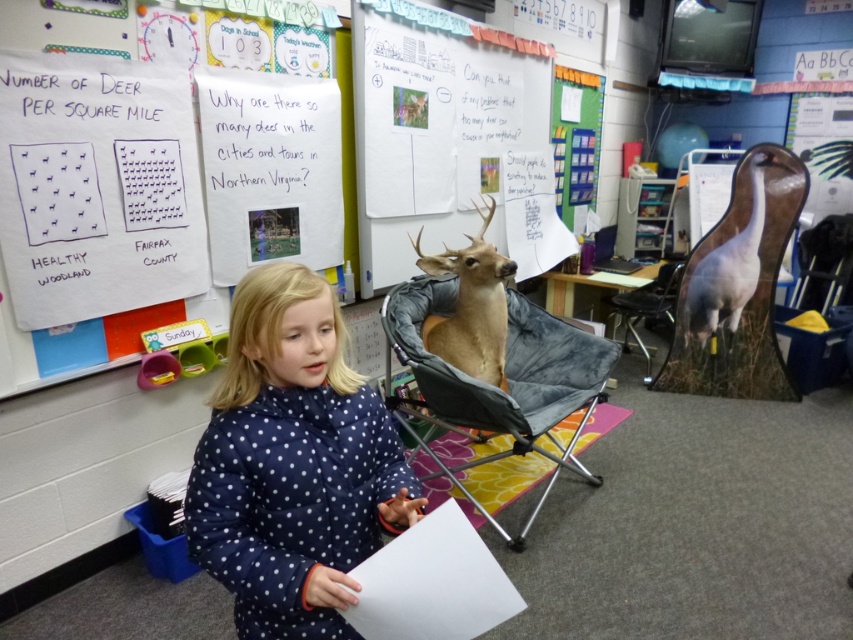
Question: Is gray fabric folding chair at center further to camera compared to white matte bird at upper right?

Choices:
 (A) no
 (B) yes

Answer: (A)

Question: Which point appears closest to the camera in this image?

Choices:
 (A) (701, 288)
 (B) (392, 298)
 (C) (474, 138)

Answer: (B)

Question: Does navy polka dot coat at center have a lesser width compared to gray fabric chair at center?

Choices:
 (A) yes
 (B) no

Answer: (A)

Question: Is whiteboard at upper center positioned before brown velvet deer at center?

Choices:
 (A) no
 (B) yes

Answer: (A)

Question: Among these objects, which one is farthest from the camera?

Choices:
 (A) white matte bird at upper right
 (B) brown velvet deer at center

Answer: (A)

Question: Estimate the real-world distances between objects in this image. Which object is farther from the brown velvet deer at center?

Choices:
 (A) gray fabric chair at center
 (B) gray fabric folding chair at center
 (C) white matte bird at upper right
 (D) whiteboard at upper center

Answer: (C)